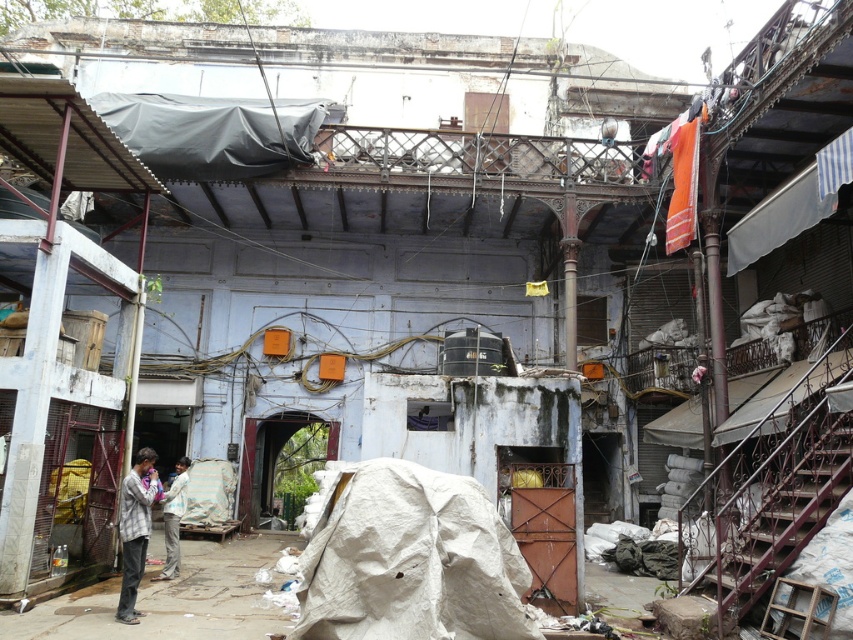
Is plaid fabric shirt at lower left bigger than light brown fabric pants at lower left?

Yes, plaid fabric shirt at lower left is bigger than light brown fabric pants at lower left.

Which is below, plaid fabric shirt at lower left or light brown fabric pants at lower left?

Positioned lower is light brown fabric pants at lower left.

Which is in front, point (134, 484) or point (177, 480)?

Point (134, 484)

What are the coordinates of `plaid fabric shirt at lower left` in the screenshot? It's located at (135, 529).